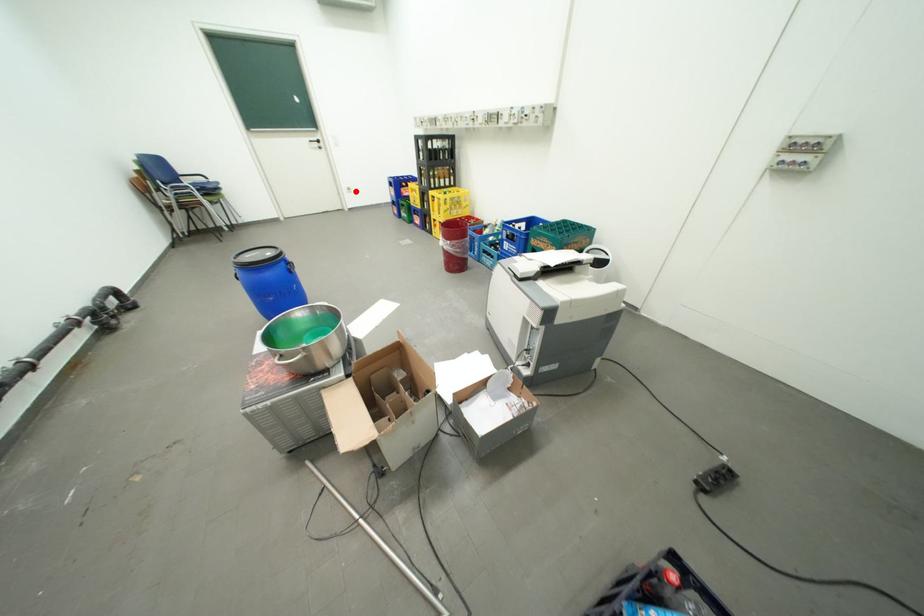
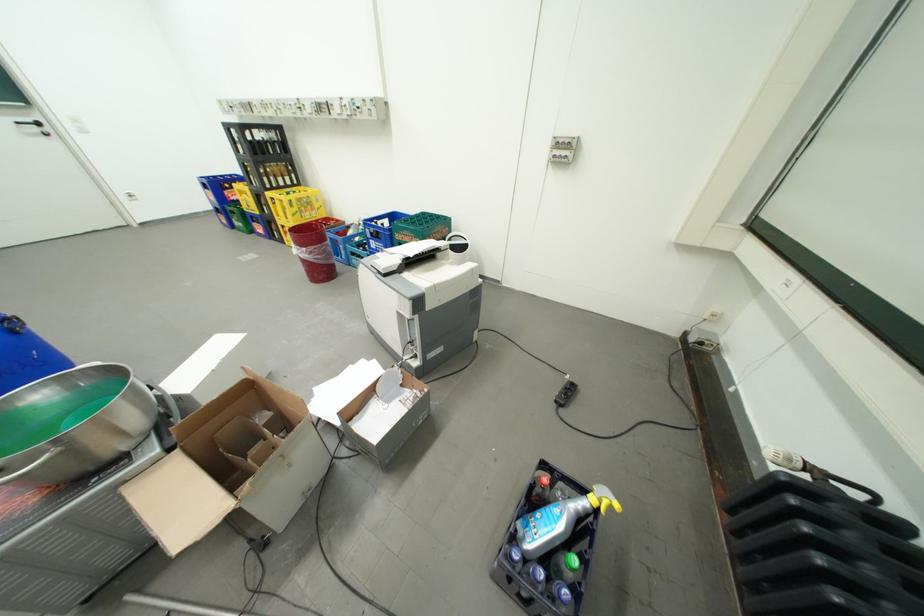
Question: I am providing you with two images of the same scene from different viewpoints. Image1 has a red point marked. In image2, the corresponding 3D location appears at what relative position? Reply with the corresponding letter.

Choices:
 (A) Closer
 (B) Farther

Answer: (B)